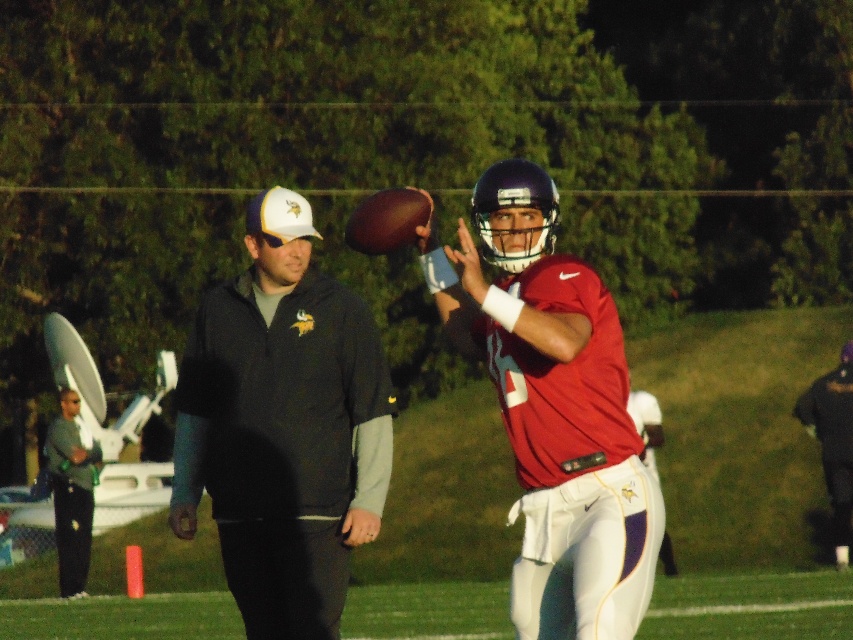
Is dark gray hoodie at left bigger than dark blue helmet at upper center?

No.

Is point (260, 243) farther from camera compared to point (846, 499)?

No.

Is point (335, 296) positioned after point (844, 424)?

No.

I want to click on dark gray hoodie at left, so click(x=283, y=428).

Does green fabric jacket at left appear over dark blue helmet at upper center?

No.

Consider the image. Who is more distant from viewer, (59, 573) or (846, 410)?

The point (59, 573) is more distant.

Describe the element at coordinates (71, 493) in the screenshot. The image size is (853, 640). I see `green fabric jacket at left` at that location.

Identify the location of green fabric jacket at left. The height and width of the screenshot is (640, 853). (71, 493).

Between point (283, 557) and point (83, 465), which one is positioned in front?

Point (283, 557) is more forward.

Looking at this image, can you confirm if dark gray hoodie at left is bigger than green fabric jacket at left?

Actually, dark gray hoodie at left might be smaller than green fabric jacket at left.

Where is `dark gray hoodie at left`? The width and height of the screenshot is (853, 640). dark gray hoodie at left is located at coordinates (283, 428).

Identify the location of dark gray hoodie at left. (283, 428).